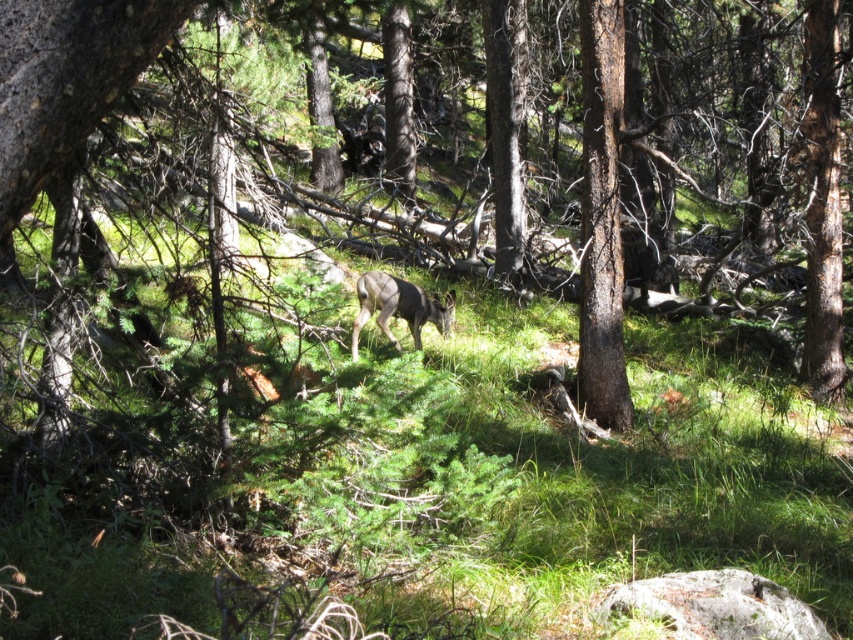
Question: Can you confirm if brown rough bark tree at right is smaller than brown fur deer at center?

Choices:
 (A) no
 (B) yes

Answer: (B)

Question: Considering the relative positions of brown rough bark tree at right and brown fur deer at center in the image provided, where is brown rough bark tree at right located with respect to brown fur deer at center?

Choices:
 (A) right
 (B) left

Answer: (A)

Question: Considering the relative positions of brown rough bark tree at right and brown fur deer at center in the image provided, where is brown rough bark tree at right located with respect to brown fur deer at center?

Choices:
 (A) left
 (B) right

Answer: (B)

Question: Which point is farther from the camera taking this photo?

Choices:
 (A) (364, 296)
 (B) (608, 330)

Answer: (B)

Question: Which of the following is the farthest from the observer?

Choices:
 (A) brown rough bark tree at right
 (B) brown fur deer at center

Answer: (A)